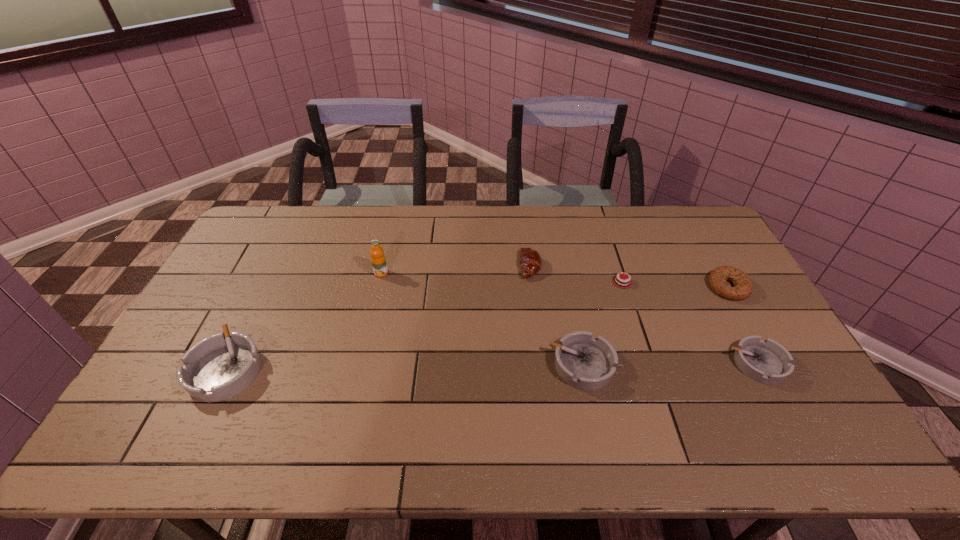
Image resolution: width=960 pixels, height=540 pixels. Find the location of `the leftmost object`. the leftmost object is located at coordinates (220, 366).

You are a GUI agent. You are given a task and a screenshot of the screen. Output one action in this format:
    pyautogui.click(x=<x>, y=<y>)
    Task: Click on the second tallest ashtray
    This screenshot has width=960, height=540.
    Given the screenshot: What is the action you would take?
    pyautogui.click(x=584, y=362)

Image resolution: width=960 pixels, height=540 pixels. I want to click on the shortest ashtray, so click(766, 361).

Where is `orange juice`? Image resolution: width=960 pixels, height=540 pixels. orange juice is located at coordinates (378, 260).

The image size is (960, 540). I want to click on the second object from left to right, so click(x=378, y=260).

This screenshot has height=540, width=960. I want to click on crescent roll, so click(x=530, y=261).

The height and width of the screenshot is (540, 960). I want to click on the shortest object, so click(625, 283).

The height and width of the screenshot is (540, 960). I want to click on the third object from right to left, so click(x=625, y=283).

Identify the location of bagel. (743, 288).

This screenshot has height=540, width=960. In order to click on vacant space located 0.190m on the right of the leftmost ashtray in this screenshot , I will do `click(333, 368)`.